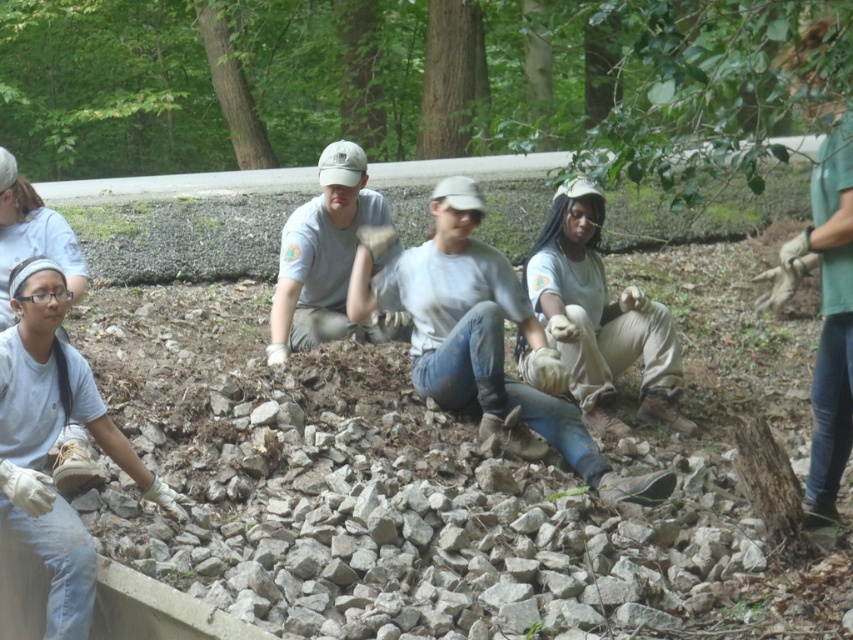
You are a photographer trying to capture a clear shot of both the white cotton shirt at center and the light brown fabric gloves at center. Since you want to focus on the gloves, which object should you position closer to the camera?

The white cotton shirt at center is much taller than the light brown fabric gloves at center, so to focus on the gloves, you should position the light brown fabric gloves at center closer to the camera.

You are a photographer trying to capture a closeup of the light brown fabric gloves at center without the matte gray shirt at center blocking the view. Is this possible given their positions?

The light brown fabric gloves at center is in front of the matte gray shirt at center, so you can capture a closeup of the light brown fabric gloves at center without the matte gray shirt at center blocking the view.

You are a photographer trying to capture a clear photo of the white cotton shirt at center. However, the matte gray shirt at center is blocking your view. Based on the scene description, can you adjust your position to take the photo without moving any people?

The white cotton shirt at center is in front of the matte gray shirt at center, so you can take the photo from the same angle without needing to move anyone because the white cotton shirt is already positioned in front.